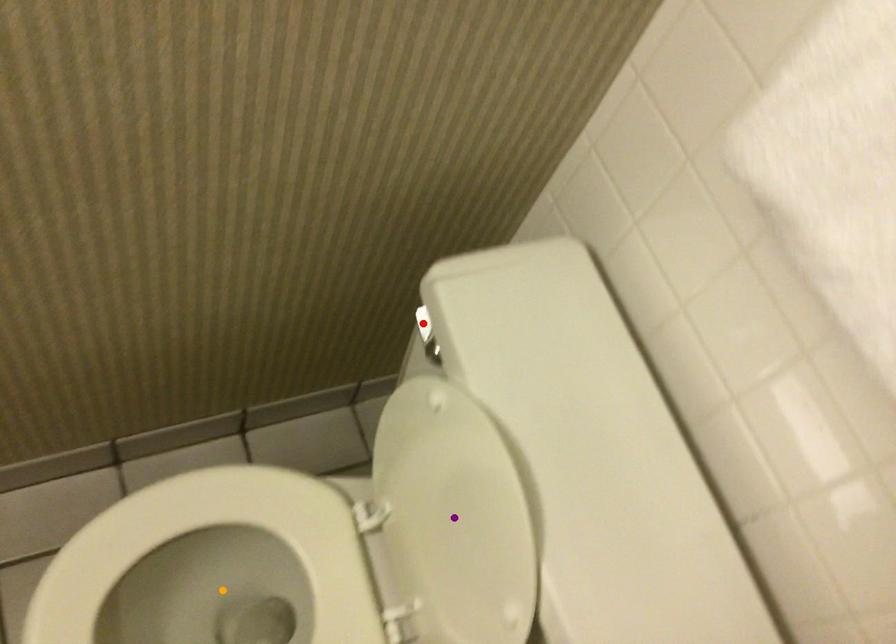
Order these from nearest to farthest:
red point
purple point
orange point

purple point < red point < orange point